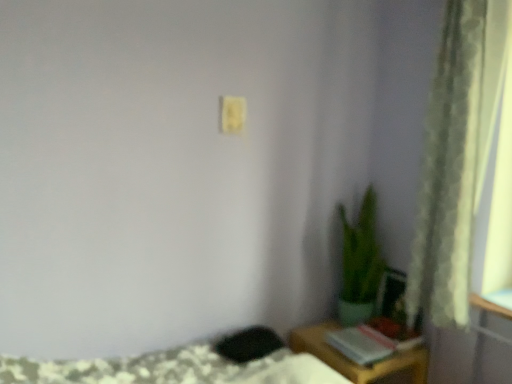
What do you see at coordinates (356, 363) in the screenshot? I see `wooden table at lower right` at bounding box center [356, 363].

What do you see at coordinates (360, 263) in the screenshot? I see `green matte plant at lower right` at bounding box center [360, 263].

Where is `hardcover book at lower right`? The image size is (512, 384). hardcover book at lower right is located at coordinates [367, 344].

Locate an element on the screen. The width and height of the screenshot is (512, 384). wooden table at lower right is located at coordinates click(356, 363).

Is green matte plant at lower right positioned beyond the bounds of hardcover book at lower right?

That's correct, green matte plant at lower right is outside of hardcover book at lower right.

Based on the photo, how different are the orientations of green matte plant at lower right and hardcover book at lower right in degrees?

90 degrees separate the facing orientations of green matte plant at lower right and hardcover book at lower right.

In terms of size, does green matte plant at lower right appear bigger or smaller than hardcover book at lower right?

green matte plant at lower right is bigger than hardcover book at lower right.

Based on their sizes in the image, would you say green matte plant at lower right is bigger or smaller than green textured curtain at right?

green matte plant at lower right is bigger than green textured curtain at right.

Looking at this image, can you confirm if green matte plant at lower right is shorter than green textured curtain at right?

Yes.

Does point (345, 221) come farther from viewer compared to point (453, 223)?

That is True.

Is green matte plant at lower right thinner than green textured curtain at right?

In fact, green matte plant at lower right might be wider than green textured curtain at right.

From a real-world perspective, between green textured curtain at right and wooden table at lower right, who is vertically higher?

In real-world perspective, green textured curtain at right is above.

Are green textured curtain at right and wooden table at lower right beside each other?

green textured curtain at right and wooden table at lower right are not in contact.

Which of these two, green textured curtain at right or wooden table at lower right, stands shorter?

wooden table at lower right.

Which is more distant, (469, 130) or (400, 357)?

The point (400, 357) is farther.

Which object is positioned more to the left, green textured curtain at right or hardcover book at lower right?

Positioned to the left is hardcover book at lower right.

Considering the relative positions of green textured curtain at right and hardcover book at lower right in the image provided, is green textured curtain at right in front of hardcover book at lower right?

That is True.

How distant is green textured curtain at right from hardcover book at lower right?

green textured curtain at right and hardcover book at lower right are 29.95 inches apart from each other.

Are green textured curtain at right and hardcover book at lower right located far from each other?

No, green textured curtain at right is in close proximity to hardcover book at lower right.

Based on their sizes in the image, would you say yellow matte light switch at upper center is bigger or smaller than hardcover book at lower right?

Clearly, yellow matte light switch at upper center is smaller in size than hardcover book at lower right.

In terms of width, does yellow matte light switch at upper center look wider or thinner when compared to hardcover book at lower right?

Clearly, yellow matte light switch at upper center has less width compared to hardcover book at lower right.

Based on the photo, do you think yellow matte light switch at upper center is within hardcover book at lower right, or outside of it?

yellow matte light switch at upper center is outside hardcover book at lower right.

From a real-world perspective, is yellow matte light switch at upper center positioned above or below hardcover book at lower right?

yellow matte light switch at upper center is above hardcover book at lower right.

From the image's perspective, is wooden table at lower right on top of green matte plant at lower right?

Actually, wooden table at lower right appears below green matte plant at lower right in the image.

Between wooden table at lower right and green matte plant at lower right, which one appears on the left side from the viewer's perspective?

From the viewer's perspective, wooden table at lower right appears more on the left side.

I want to click on houseplant lying on the right of wooden table at lower right, so click(x=360, y=263).

Which is behind, wooden table at lower right or green matte plant at lower right?

green matte plant at lower right is more distant.

From the image's perspective, is yellow matte light switch at upper center below wooden table at lower right?

Actually, yellow matte light switch at upper center appears above wooden table at lower right in the image.

Who is shorter, yellow matte light switch at upper center or wooden table at lower right?

With less height is yellow matte light switch at upper center.

Is yellow matte light switch at upper center inside or outside of wooden table at lower right?

yellow matte light switch at upper center is located beyond the bounds of wooden table at lower right.

The image size is (512, 384). Identify the location of houseplant above the hardcover book at lower right (from the image's perspective). (360, 263).

Locate an element on the screen. curtain on the right of green matte plant at lower right is located at coordinates (456, 157).

Which object lies nearer to the anchor point hardcover book at lower right, green textured curtain at right or yellow matte light switch at upper center?

green textured curtain at right.

Which object lies nearer to the anchor point hardcover book at lower right, green textured curtain at right or green matte plant at lower right?

green matte plant at lower right is closer to hardcover book at lower right.

From the image, which object appears to be nearer to hardcover book at lower right, wooden table at lower right or yellow matte light switch at upper center?

The object closer to hardcover book at lower right is wooden table at lower right.

Considering their positions, is yellow matte light switch at upper center positioned further to green textured curtain at right than green matte plant at lower right?

The object further to green textured curtain at right is yellow matte light switch at upper center.

From the image, which object appears to be nearer to green matte plant at lower right, green textured curtain at right or wooden table at lower right?

wooden table at lower right is positioned closer to the anchor green matte plant at lower right.

Which object lies further to the anchor point green matte plant at lower right, wooden table at lower right or yellow matte light switch at upper center?

yellow matte light switch at upper center lies further to green matte plant at lower right than the other object.

Looking at the image, which one is located closer to yellow matte light switch at upper center, green matte plant at lower right or green textured curtain at right?

green matte plant at lower right.

From the image, which object appears to be farther from hardcover book at lower right, wooden table at lower right or green textured curtain at right?

green textured curtain at right is further to hardcover book at lower right.

Locate an element on the screen. Image resolution: width=512 pixels, height=384 pixels. book between green textured curtain at right and wooden table at lower right in the vertical direction is located at coordinates [x=367, y=344].

The height and width of the screenshot is (384, 512). In order to click on houseplant between yellow matte light switch at upper center and hardcover book at lower right vertically in this screenshot , I will do `click(360, 263)`.

Where is `houseplant between green textured curtain at right and wooden table at lower right vertically`? The height and width of the screenshot is (384, 512). houseplant between green textured curtain at right and wooden table at lower right vertically is located at coordinates (360, 263).

The height and width of the screenshot is (384, 512). I want to click on houseplant between yellow matte light switch at upper center and wooden table at lower right vertically, so click(360, 263).